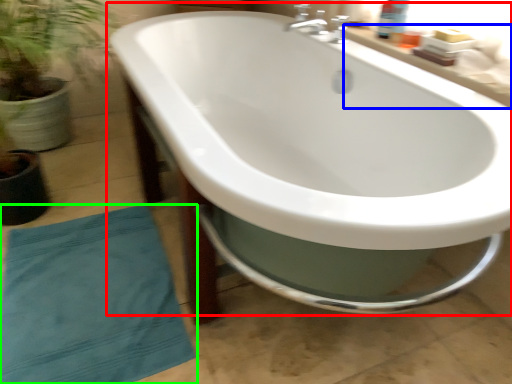
Question: Which is farther away from bathtub (highlighted by a red box)? counter top (highlighted by a blue box) or beach towel (highlighted by a green box)?

Choices:
 (A) counter top
 (B) beach towel

Answer: (B)